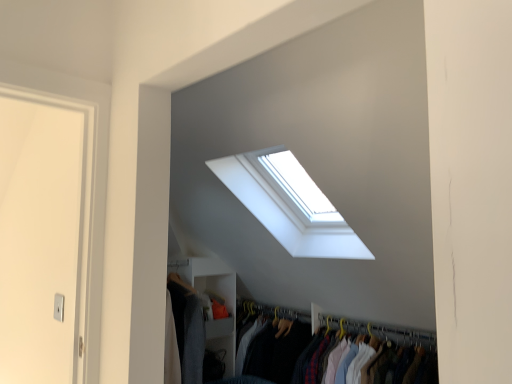
What is the approximate width of yellow plastic hanger at upper center?

yellow plastic hanger at upper center is 1.18 inches wide.

Identify the location of yellow plastic hanger at upper center. (381, 331).

Describe the element at coordinates (214, 293) in the screenshot. I see `white matte closet at lower left, which is counted as the second closet, starting from the right` at that location.

The width and height of the screenshot is (512, 384). In order to click on yellow plastic hanger at upper center in this screenshot , I will do coord(381,331).

Is white glass window at upper center outside of white matte closet at lower left, which is counted as the second closet, starting from the right?

Yes.

Is white glass window at upper center oriented towards white matte closet at lower left, the second closet from the front?

No, white glass window at upper center is not aimed at white matte closet at lower left, the second closet from the front.

Does white glass window at upper center touch white matte closet at lower left, which is counted as the second closet, starting from the right?

white glass window at upper center and white matte closet at lower left, which is counted as the second closet, starting from the right, are not in contact.

Which is in front, point (328, 236) or point (211, 264)?

Point (328, 236)

Between white glass window at upper center and yellow plastic hanger at upper center, which one has larger size?

With larger size is white glass window at upper center.

Considering the positions of point (336, 227) and point (395, 327), is point (336, 227) closer or farther from the camera than point (395, 327)?

Clearly, point (336, 227) is closer to the camera than point (395, 327).

Can you tell me how much white glass window at upper center and yellow plastic hanger at upper center differ in facing direction?

They differ by 0.0331 degrees in their facing directions.

Can you see white glass window at upper center touching yellow plastic hanger at upper center?

white glass window at upper center and yellow plastic hanger at upper center are not in contact.

Is point (432, 332) positioned in front of point (435, 340)?

No, (432, 332) is further to viewer.

Does yellow plastic hanger at upper center appear on the right side of white fabric clothes at center, the second closet positioned from the left?

Yes.

How far apart are yellow plastic hanger at upper center and white fabric clothes at center, arranged as the second closet when viewed from the back?

A distance of 3.03 inches exists between yellow plastic hanger at upper center and white fabric clothes at center, arranged as the second closet when viewed from the back.

Between yellow plastic hanger at upper center and white fabric clothes at center, the second closet positioned from the left, which one has more height?

With more height is white fabric clothes at center, the second closet positioned from the left.

Can we say yellow plastic hanger at upper center lies outside white matte closet at lower left, the first closet viewed from the left?

Yes, yellow plastic hanger at upper center is outside of white matte closet at lower left, the first closet viewed from the left.

From a real-world perspective, relative to white matte closet at lower left, which is counted as the second closet, starting from the right, is yellow plastic hanger at upper center vertically above or below?

From a real-world perspective, yellow plastic hanger at upper center is physically above white matte closet at lower left, which is counted as the second closet, starting from the right.

Can you see yellow plastic hanger at upper center touching white matte closet at lower left, the second closet from the front?

yellow plastic hanger at upper center and white matte closet at lower left, the second closet from the front, are clearly separated.

Considering the positions of points (378, 329) and (342, 238), is point (378, 329) farther from camera compared to point (342, 238)?

That is True.

From a real-world perspective, which object stands above the other?

white glass window at upper center.

In terms of width, does yellow plastic hanger at upper center look wider or thinner when compared to white glass window at upper center?

yellow plastic hanger at upper center is thinner than white glass window at upper center.

Is the position of yellow plastic hanger at upper center more distant than that of white glass window at upper center?

Yes, the depth of yellow plastic hanger at upper center is greater than that of white glass window at upper center.

How different are the orientations of white matte closet at lower left, the first closet viewed from the left, and white glass window at upper center in degrees?

The angle between the facing direction of white matte closet at lower left, the first closet viewed from the left, and the facing direction of white glass window at upper center is 89.6 degrees.

Looking at their sizes, would you say white matte closet at lower left, which is counted as the second closet, starting from the right, is wider or thinner than white glass window at upper center?

white matte closet at lower left, which is counted as the second closet, starting from the right, is thinner than white glass window at upper center.

From a real-world perspective, is white matte closet at lower left, which appears as the 1th closet when viewed from the back, physically below white glass window at upper center?

Yes, from a real-world perspective, white matte closet at lower left, which appears as the 1th closet when viewed from the back, is under white glass window at upper center.

Between white fabric clothes at center, the first closet from the right, and white matte closet at lower left, which appears as the 1th closet when viewed from the back, which one has larger width?

Wider between the two is white fabric clothes at center, the first closet from the right.

From a real-world perspective, between white fabric clothes at center, arranged as the second closet when viewed from the back, and white matte closet at lower left, which appears as the 1th closet when viewed from the back, who is vertically lower?

white fabric clothes at center, arranged as the second closet when viewed from the back, is physically lower.

Between white fabric clothes at center, the first closet from the right, and white matte closet at lower left, the second closet from the front, which one has less height?

white fabric clothes at center, the first closet from the right.

Image resolution: width=512 pixels, height=384 pixels. In order to click on the 2nd closet behind the white glass window at upper center in this screenshot , I will do `click(214, 293)`.

Locate an element on the screen. window located above the yellow plastic hanger at upper center (from the image's perspective) is located at coordinates click(285, 210).

Based on their spatial positions, is white matte closet at lower left, the first closet viewed from the left, or white fabric clothes at center, arranged as the second closet when viewed from the back, further from yellow plastic hanger at upper center?

The object further to yellow plastic hanger at upper center is white matte closet at lower left, the first closet viewed from the left.

Considering their positions, is white fabric clothes at center, arranged as the first closet when viewed from the front, positioned closer to white matte closet at lower left, the first closet viewed from the left, than yellow plastic hanger at upper center?

white fabric clothes at center, arranged as the first closet when viewed from the front.

When comparing their distances from white fabric clothes at center, arranged as the first closet when viewed from the front, does white glass window at upper center or yellow plastic hanger at upper center seem further?

white glass window at upper center is further to white fabric clothes at center, arranged as the first closet when viewed from the front.

Consider the image. Estimate the real-world distances between objects in this image. Which object is further from white fabric clothes at center, arranged as the second closet when viewed from the back, white matte closet at lower left, the second closet from the front, or yellow plastic hanger at upper center?

Among the two, white matte closet at lower left, the second closet from the front, is located further to white fabric clothes at center, arranged as the second closet when viewed from the back.

Estimate the real-world distances between objects in this image. Which object is further from white glass window at upper center, white matte closet at lower left, the first closet viewed from the left, or white fabric clothes at center, arranged as the second closet when viewed from the back?

Among the two, white matte closet at lower left, the first closet viewed from the left, is located further to white glass window at upper center.

From the image, which object appears to be farther from white glass window at upper center, yellow plastic hanger at upper center or white fabric clothes at center, arranged as the first closet when viewed from the front?

white fabric clothes at center, arranged as the first closet when viewed from the front, lies further to white glass window at upper center than the other object.

In the scene shown: From the image, which object appears to be farther from white matte closet at lower left, which is counted as the second closet, starting from the right, white fabric clothes at center, the first closet from the right, or white glass window at upper center?

white glass window at upper center.

In the scene shown: Considering their positions, is white matte closet at lower left, the first closet viewed from the left, positioned further to white glass window at upper center than yellow plastic hanger at upper center?

white matte closet at lower left, the first closet viewed from the left, is further to white glass window at upper center.

At what (x,y) coordinates should I click in order to perform the action: click on hanger between white glass window at upper center and white fabric clothes at center, arranged as the first closet when viewed from the front, in the vertical direction. Please return your answer as a coordinate pair (x, y). The height and width of the screenshot is (384, 512). Looking at the image, I should click on (381, 331).

At what (x,y) coordinates should I click in order to perform the action: click on window between white matte closet at lower left, the second closet from the front, and yellow plastic hanger at upper center. Please return your answer as a coordinate pair (x, y). Looking at the image, I should click on (285, 210).

This screenshot has width=512, height=384. Find the location of `closet located between white matte closet at lower left, which appears as the 1th closet when viewed from the back, and yellow plastic hanger at upper center in the left-right direction`. closet located between white matte closet at lower left, which appears as the 1th closet when viewed from the back, and yellow plastic hanger at upper center in the left-right direction is located at coordinates (343, 324).

Locate an element on the screen. Image resolution: width=512 pixels, height=384 pixels. closet between white glass window at upper center and white fabric clothes at center, arranged as the first closet when viewed from the front, in the vertical direction is located at coordinates click(x=214, y=293).